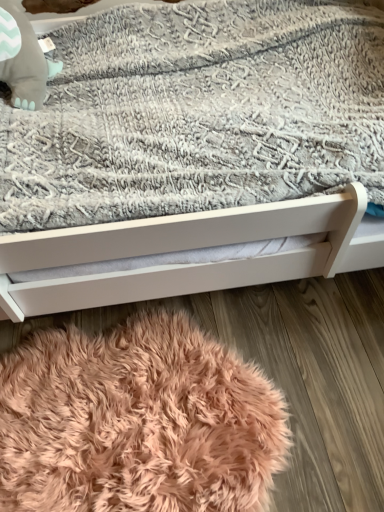
Question: In terms of width, does white matte bed at center look wider or thinner when compared to peachy soft rug at lower center?

Choices:
 (A) wide
 (B) thin

Answer: (A)

Question: From the image's perspective, is white matte bed at center located above or below peachy soft rug at lower center?

Choices:
 (A) below
 (B) above

Answer: (B)

Question: Based on their relative distances, which object is nearer to the white matte bed at center?

Choices:
 (A) peachy soft rug at lower center
 (B) matte gray plush baby elephant at upper left

Answer: (A)

Question: Estimate the real-world distances between objects in this image. Which object is farther from the matte gray plush baby elephant at upper left?

Choices:
 (A) white matte bed at center
 (B) peachy soft rug at lower center

Answer: (B)